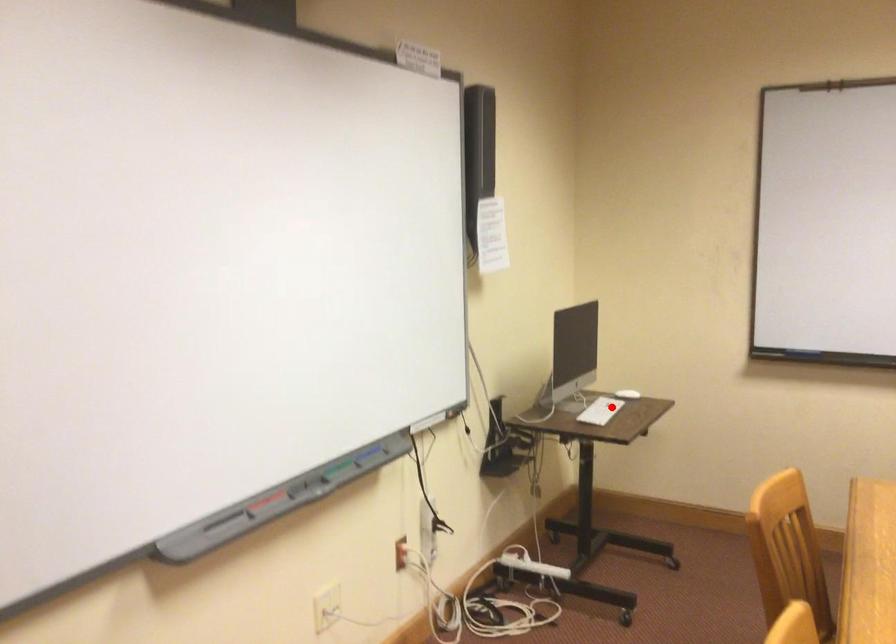
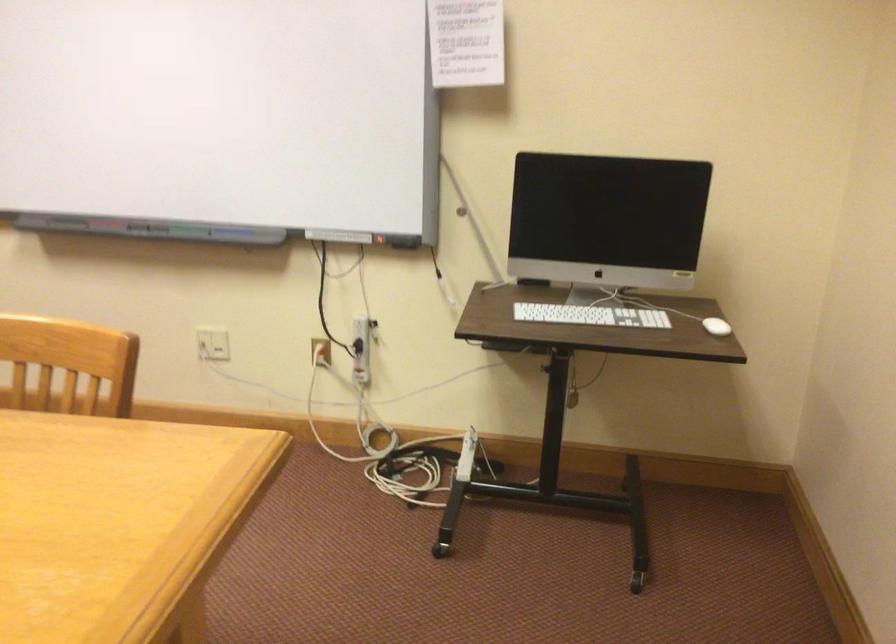
Question: I am providing you with two images of the same scene from different viewpoints. Image1 has a red point marked. In image2, the corresponding 3D location appears at what relative position? Reply with the corresponding letter.

Choices:
 (A) Closer
 (B) Farther

Answer: (A)